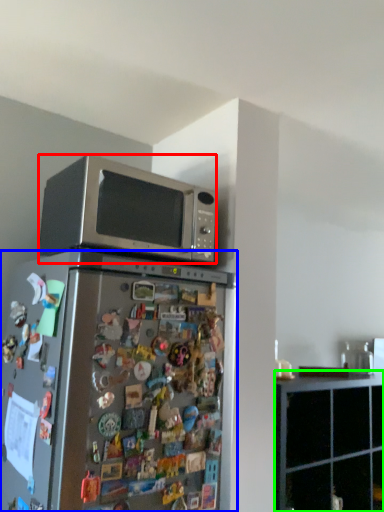
Question: Which is nearer to the microwave oven (highlighted by a red box)? refrigerator (highlighted by a blue box) or cabinetry (highlighted by a green box).

Choices:
 (A) refrigerator
 (B) cabinetry

Answer: (A)